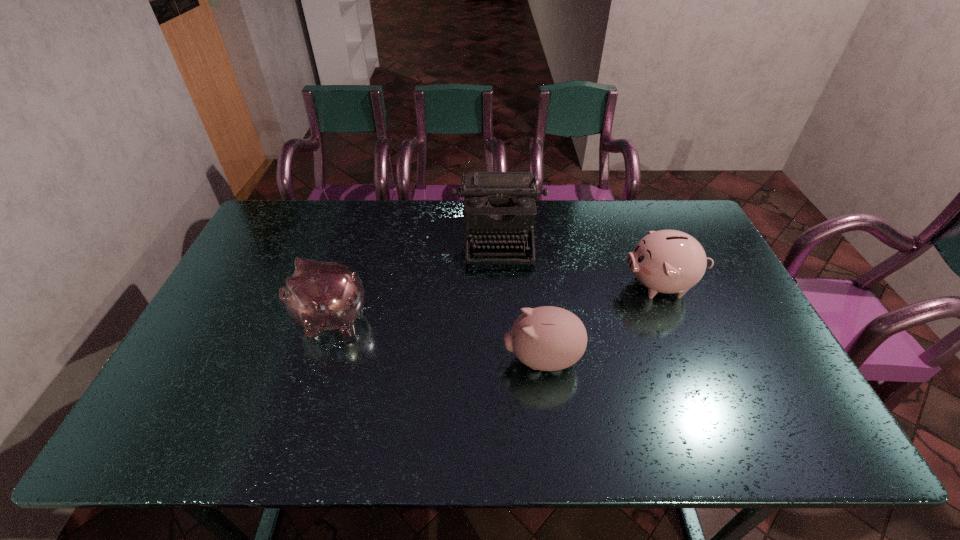
In order to click on vacant area that lies between the typewriter and the rightmost piggy bank in this screenshot , I will do `click(581, 262)`.

This screenshot has height=540, width=960. I want to click on blank region between the leftmost piggy bank and the second piggy bank from right to left, so click(437, 339).

The width and height of the screenshot is (960, 540). What are the coordinates of `vacant area that lies between the leftmost object and the typewriter` in the screenshot? It's located at (415, 279).

This screenshot has height=540, width=960. In order to click on vacant space in between the leftmost piggy bank and the typewriter in this screenshot , I will do `click(415, 279)`.

The width and height of the screenshot is (960, 540). In order to click on vacant region between the leftmost piggy bank and the second piggy bank from left to right in this screenshot , I will do `click(437, 339)`.

At what (x,y) coordinates should I click in order to perform the action: click on blank region between the second piggy bank from right to left and the rightmost object. Please return your answer as a coordinate pair (x, y). This screenshot has height=540, width=960. Looking at the image, I should click on (602, 322).

Identify the location of empty location between the typewriter and the rightmost piggy bank. (581, 262).

The height and width of the screenshot is (540, 960). What are the coordinates of `vacant space that is in between the second piggy bank from right to left and the rightmost piggy bank` in the screenshot? It's located at (602, 322).

You are a GUI agent. You are given a task and a screenshot of the screen. Output one action in this format:
    pyautogui.click(x=<x>, y=<y>)
    Task: Click on the free space between the leftmost object and the second piggy bank from left to right
    The height and width of the screenshot is (540, 960).
    Given the screenshot: What is the action you would take?
    pyautogui.click(x=437, y=339)

Where is `object that can be found as the closest to the second piggy bank from right to left`? object that can be found as the closest to the second piggy bank from right to left is located at coordinates (666, 261).